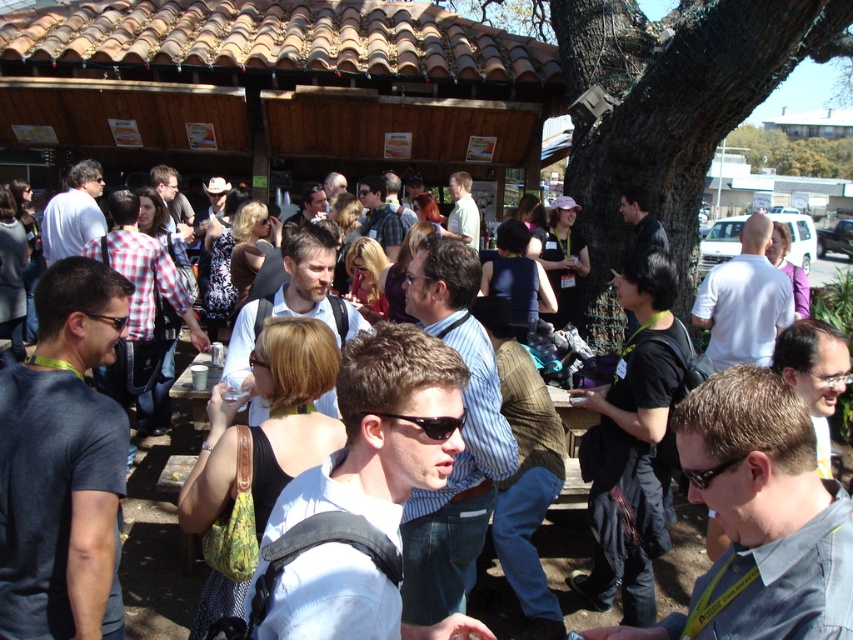
You are at the entrance of the pavilion and want to find the person wearing the denim shirt at center. According to the coordinates provided, in which direction should you look relative to your current position?

The denim shirt at center is located at point (759,516), which means you should look towards the lower right direction from your current position at the entrance.

You are at the event and want to greet both the person with light brown hair at center and the person with matte black shirt at center. Since you can only approach one at a time, which one should you approach first if you want to minimize the distance you walk?

You should approach the matte black shirt at center first because the light brown hair at center is to the right of matte black shirt at center, so the matte black shirt at center is closer to your current position at the center.